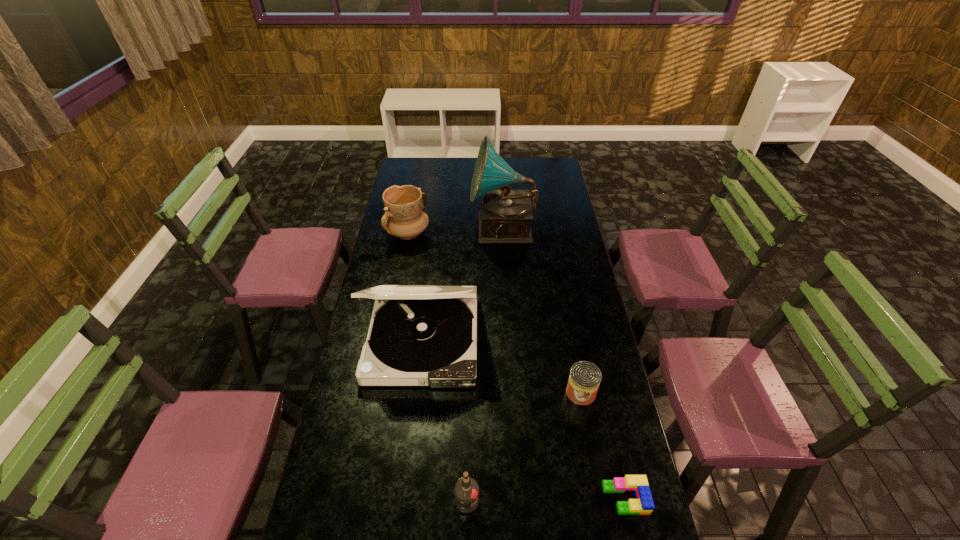
The width and height of the screenshot is (960, 540). Identify the location of free point between the tallest object and the shortest object. (564, 364).

Find the location of a particular element. object that stands as the third closest to the second tallest object is located at coordinates (404, 217).

I want to click on object that is the third closest to the CD player, so click(x=404, y=217).

At what (x,y) coordinates should I click in order to perform the action: click on free spot that satisfies the following two spatial constraints: 1. on the horn of the record player; 2. on the left side of the can. Please return your answer as a coordinate pair (x, y). The height and width of the screenshot is (540, 960). Looking at the image, I should click on [513, 392].

The width and height of the screenshot is (960, 540). I want to click on vacant space that satisfies the following two spatial constraints: 1. on the back side of the second shortest object; 2. on the horn of the tallest object, so click(551, 230).

Identify the location of free spot that satisfies the following two spatial constraints: 1. on the horn of the tallest object; 2. on the front side of the third tallest object. This screenshot has width=960, height=540. (503, 233).